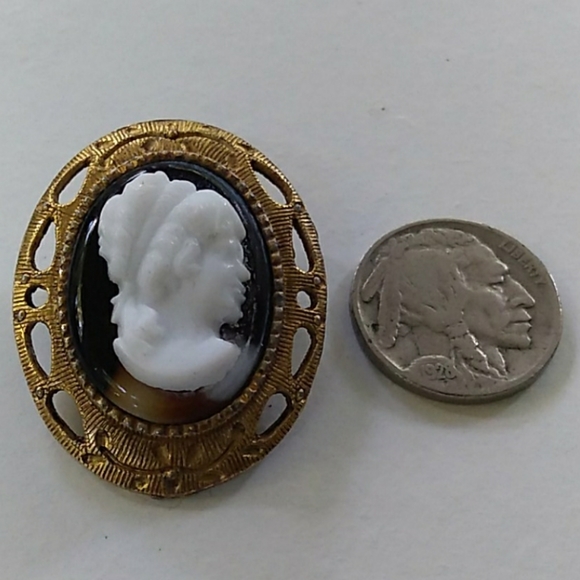
Where is `white surface`? white surface is located at coordinates (x=369, y=507).